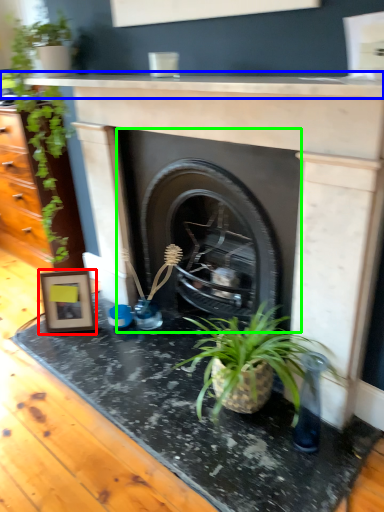
Question: Considering the real-world distances, which object is closest to picture frame (highlighted by a red box)? counter top (highlighted by a blue box) or fireplace (highlighted by a green box).

Choices:
 (A) counter top
 (B) fireplace

Answer: (B)